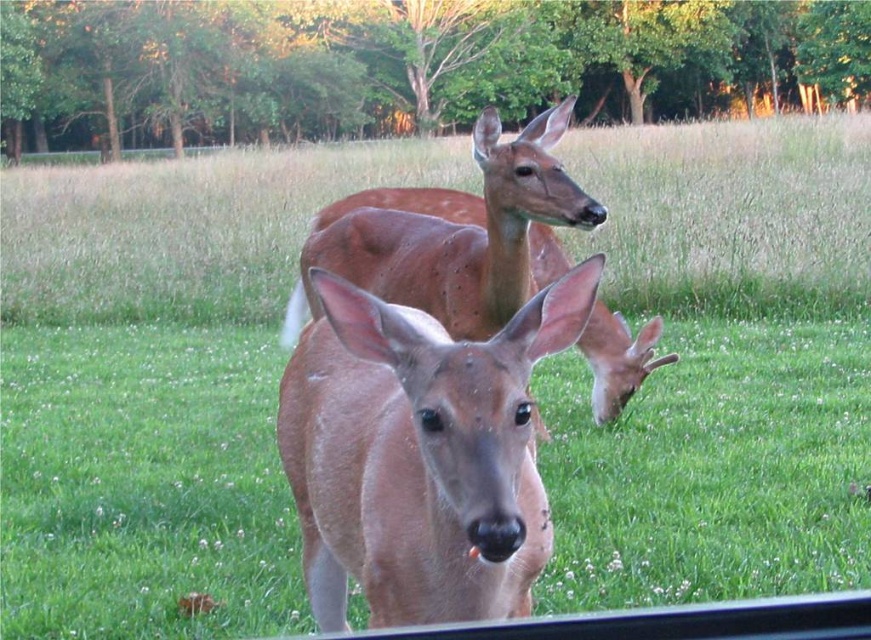
The image size is (871, 640). Describe the element at coordinates (420, 454) in the screenshot. I see `matte brown deer at center` at that location.

Between point (345, 372) and point (419, 202), which one is positioned in front?

Positioned in front is point (345, 372).

Locate an element on the screen. The width and height of the screenshot is (871, 640). matte brown deer at center is located at coordinates (420, 454).